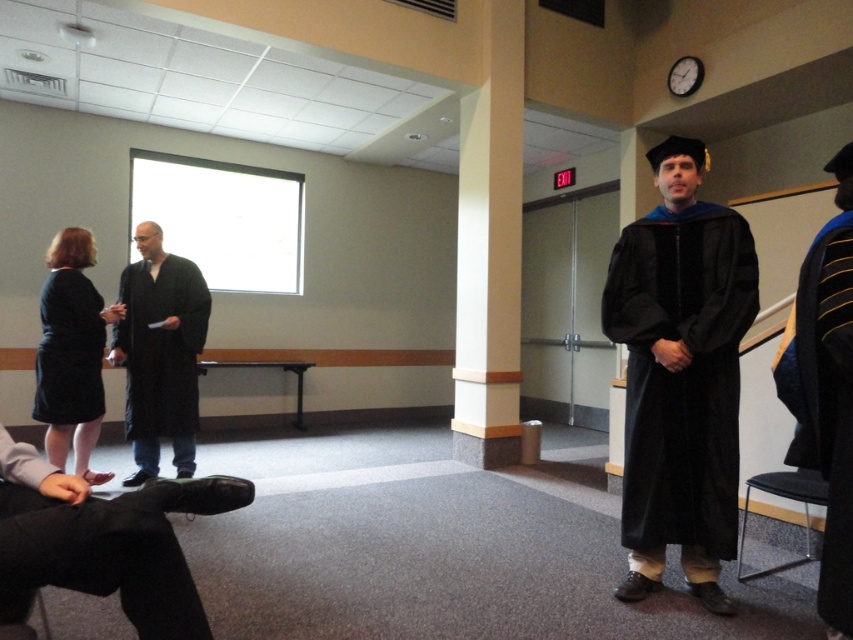
Who is higher up, black matte robe at left or black matte dress at left?

Positioned higher is black matte dress at left.

Is black matte robe at left closer to the viewer compared to black matte dress at left?

That is False.

Does point (135, 406) come farther from viewer compared to point (57, 355)?

Yes, it is.

This screenshot has width=853, height=640. Find the location of `black matte robe at left`. black matte robe at left is located at coordinates (160, 353).

Is black velvet gown at center to the right of black matte dress at left from the viewer's perspective?

Correct, you'll find black velvet gown at center to the right of black matte dress at left.

Between point (746, 244) and point (85, 358), which one is positioned behind?

Point (85, 358)

Where is `black velvet gown at center`? The width and height of the screenshot is (853, 640). black velvet gown at center is located at coordinates (682, 372).

Is point (44, 310) more distant than point (49, 310)?

Yes, point (44, 310) is behind point (49, 310).

Does point (36, 376) lie in front of point (77, 412)?

No, (36, 376) is behind (77, 412).

Is point (91, 400) more distant than point (62, 364)?

Yes, point (91, 400) is farther from viewer.

In order to click on black fabric dress at left in this screenshot , I will do `click(71, 353)`.